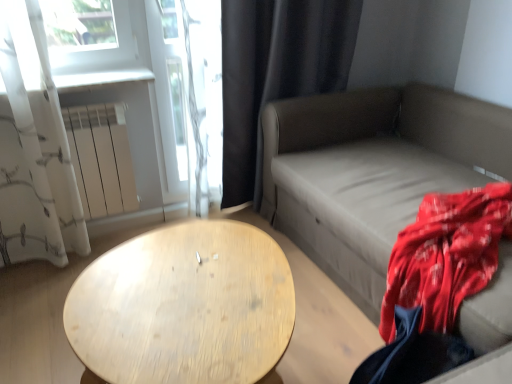
Question: Is point [x=74, y=119] positioned closer to the camera than point [x=52, y=125]?

Choices:
 (A) farther
 (B) closer

Answer: (A)

Question: Considering the positions of white matte radiator at left and white sheer curtain at left, the 1th curtain viewed from the left, in the image, is white matte radiator at left taller or shorter than white sheer curtain at left, the 1th curtain viewed from the left,?

Choices:
 (A) tall
 (B) short

Answer: (B)

Question: Which of these objects is positioned farthest from the white sheer curtain at left, the 1th curtain viewed from the left?

Choices:
 (A) white matte radiator at left
 (B) black fabric curtain at upper right, the first curtain viewed from the right
 (C) light wood/texture table at center
 (D) matte gray couch at right

Answer: (D)

Question: Estimate the real-world distances between objects in this image. Which object is closer to the white matte radiator at left?

Choices:
 (A) black fabric curtain at upper right, the 2th curtain positioned from the left
 (B) white sheer curtain at left, the 1th curtain viewed from the left
 (C) matte gray couch at right
 (D) light wood/texture table at center

Answer: (B)